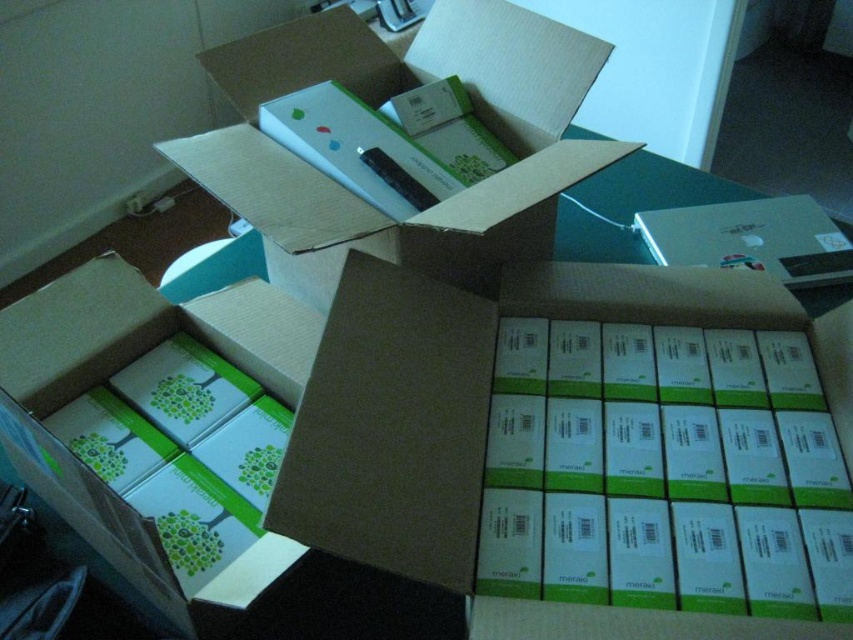
You are packing items for shipping and need to place a fragile item in one of the boxes. The white cardboard box at upper center and the white matte box at center are available. Which box should you choose if you want to place it to the right of the other box?

You should place the fragile item in the white cardboard box at upper center because it is already positioned to the right of the white matte box at center.

You are packing items into a shipping container and need to ensure that the white matte cardboard box at center and the white cardboard box at upper center are visible for inventory. Which box should you place closer to the front so that both are visible?

→ The white matte cardboard box at center should be placed closer to the front because it is already positioned in front of the white cardboard box at upper center, making it naturally more visible for inventory purposes.

You are packing items into two large open cardboard boxes placed on a dark surface. You have two points marked at coordinates point (486,160). How far apart are these two points in inches?

The two points marked at coordinates point (486,160) are 30.12 inches apart.